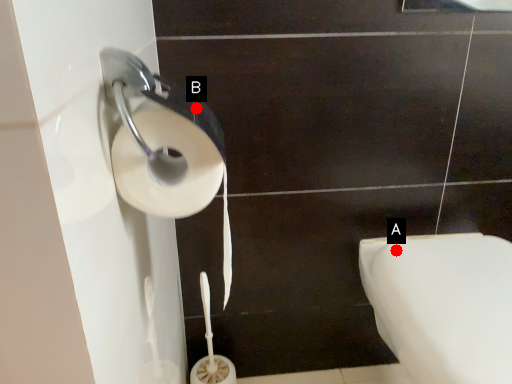
Question: Two points are circled on the image, labeled by A and B beside each circle. Which point is farther to the camera?

Choices:
 (A) A is further
 (B) B is further

Answer: (A)